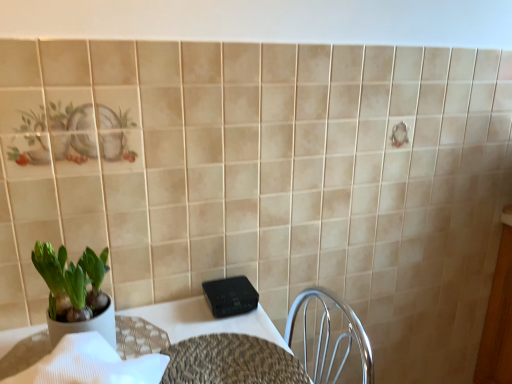
What is the approximate height of leopard print table at center?

It is 0.39 inches.

Image resolution: width=512 pixels, height=384 pixels. I want to click on leather textured table at lower left, so click(x=185, y=326).

Image resolution: width=512 pixels, height=384 pixels. Describe the element at coordinates (185, 326) in the screenshot. I see `leather textured table at lower left` at that location.

At what (x,y) coordinates should I click in order to perform the action: click on green matte pot at left. Please return your answer as a coordinate pair (x, y). The image size is (512, 384). Looking at the image, I should click on (75, 292).

Locate an element on the screen. Image resolution: width=512 pixels, height=384 pixels. leopard print table at center is located at coordinates (231, 361).

Considering the relative sizes of green matte pot at left and leather textured table at lower left in the image provided, is green matte pot at left shorter than leather textured table at lower left?

No.

Does green matte pot at left have a larger size compared to leather textured table at lower left?

No, green matte pot at left is not bigger than leather textured table at lower left.

Identify the location of table that appears on the right of green matte pot at left. (185, 326).

Is point (78, 284) closer or farther from the camera than point (248, 317)?

Point (78, 284) is positioned closer to the camera compared to point (248, 317).

Where is `table on the left of leopard print table at center`? Image resolution: width=512 pixels, height=384 pixels. table on the left of leopard print table at center is located at coordinates (185, 326).

Are leather textured table at lower left and leopard print table at center far apart?

No.

What's the angular difference between leather textured table at lower left and leopard print table at center's facing directions?

0.185 degrees separate the facing orientations of leather textured table at lower left and leopard print table at center.

From a real-world perspective, is leather textured table at lower left under leopard print table at center?

No, from a real-world perspective, leather textured table at lower left is not under leopard print table at center.

How many degrees apart are the facing directions of leather textured table at lower left and green matte pot at left?

0.000667 degrees separate the facing orientations of leather textured table at lower left and green matte pot at left.

Between leather textured table at lower left and green matte pot at left, which one has larger width?

Wider between the two is leather textured table at lower left.

From their relative heights in the image, would you say leather textured table at lower left is taller or shorter than green matte pot at left?

Clearly, leather textured table at lower left is shorter compared to green matte pot at left.

Who is more distant, leather textured table at lower left or green matte pot at left?

green matte pot at left is more distant.

From a real-world perspective, which object rests below the other?

leopard print table at center, from a real-world perspective.

Is the position of green matte pot at left more distant than that of leopard print table at center?

Yes, it is behind leopard print table at center.

Is leopard print table at center inside green matte pot at left?

Actually, leopard print table at center is outside green matte pot at left.

In terms of height, does green matte pot at left look taller or shorter compared to leopard print table at center?

In the image, green matte pot at left appears to be taller than leopard print table at center.

Image resolution: width=512 pixels, height=384 pixels. Identify the location of table that appears on the left of leopard print table at center. (185, 326).

Which is less distant, (291,382) or (27,367)?

Clearly, point (291,382) is more distant from the camera than point (27,367).

Which object is thinner, leopard print table at center or leather textured table at lower left?

leather textured table at lower left is thinner.

Which object is positioned more to the right, leopard print table at center or leather textured table at lower left?

Positioned to the right is leopard print table at center.

Is green matte pot at left completely or partially inside leopard print table at center?

No, green matte pot at left is located outside of leopard print table at center.

Is leopard print table at center next to green matte pot at left and touching it?

leopard print table at center and green matte pot at left are clearly separated.

Is leopard print table at center looking in the opposite direction of green matte pot at left?

leopard print table at center does not have its back to green matte pot at left.

Which point is more forward, [227,364] or [111,337]?

The point [111,337] is closer.

I want to click on table that appears on the right of green matte pot at left, so click(185, 326).

In order to click on table in front of the leopard print table at center in this screenshot , I will do `click(185, 326)`.

Considering their positions, is leather textured table at lower left positioned further to green matte pot at left than leopard print table at center?

leopard print table at center.

When comparing their distances from leather textured table at lower left, does green matte pot at left or leopard print table at center seem further?

green matte pot at left lies further to leather textured table at lower left than the other object.

Estimate the real-world distances between objects in this image. Which object is further from leather textured table at lower left, leopard print table at center or green matte pot at left?

green matte pot at left.

Looking at the image, which one is located closer to green matte pot at left, leopard print table at center or leather textured table at lower left?

Based on the image, leather textured table at lower left appears to be nearer to green matte pot at left.

Looking at the image, which one is located closer to leopard print table at center, green matte pot at left or leather textured table at lower left?

Among the two, leather textured table at lower left is located nearer to leopard print table at center.

Which object lies further to the anchor point leopard print table at center, leather textured table at lower left or green matte pot at left?

green matte pot at left is positioned further to the anchor leopard print table at center.

The image size is (512, 384). What are the coordinates of `table located between green matte pot at left and leopard print table at center in the left-right direction` in the screenshot? It's located at (185, 326).